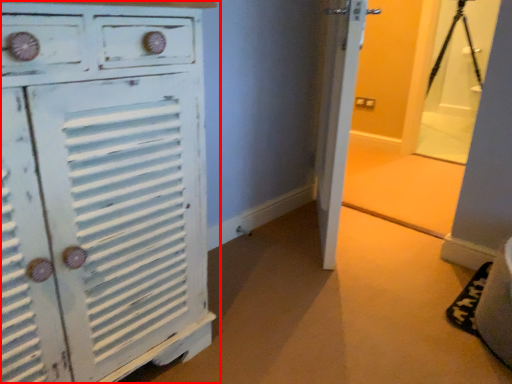
Question: Considering the relative positions of chest of drawers (annotated by the red box) and tripod in the image provided, where is chest of drawers (annotated by the red box) located with respect to the staircase?

Choices:
 (A) right
 (B) left

Answer: (B)